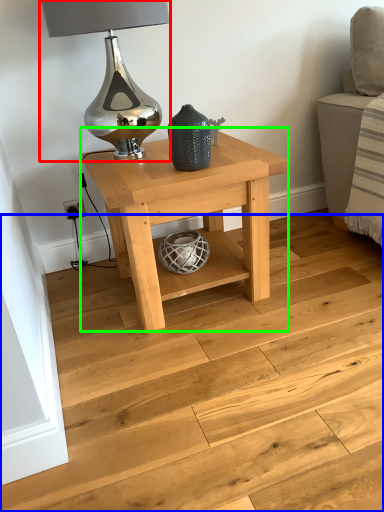
Question: Estimate the real-world distances between objects in this image. Which object is farther from table lamp (highlighted by a red box), stairwell (highlighted by a blue box) or table (highlighted by a green box)?

Choices:
 (A) stairwell
 (B) table

Answer: (A)